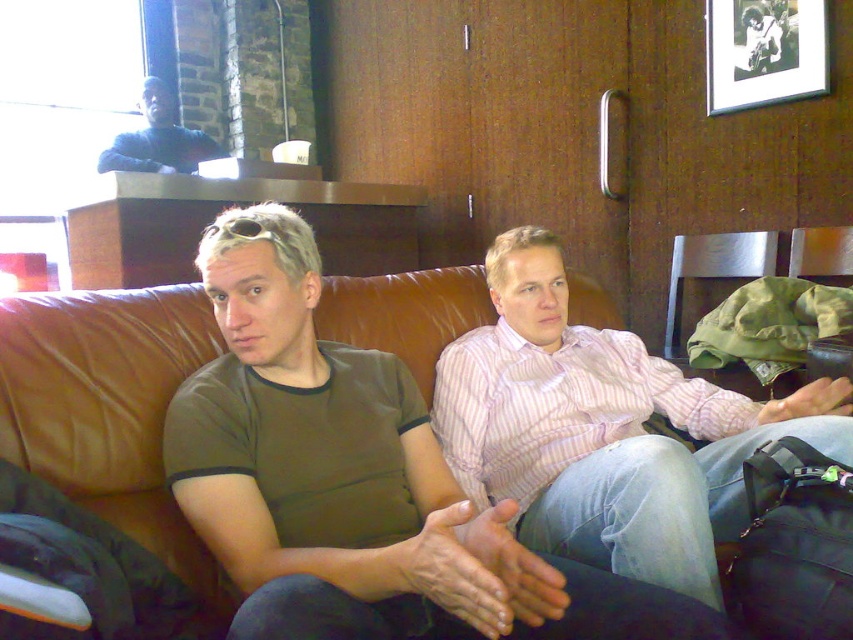
You are designing a room layout and need to place a floor lamp next to the brown leather couch at center. Considering the height of the black matte picture frame at upper right, will the floor lamp be taller than the picture frame?

The brown leather couch at center has a greater height compared to the black matte picture frame at upper right. Since the floor lamp will be placed next to the couch, it will likely be taller than the picture frame as the couch itself is already taller.

You are a tailor measuring the distance between the pink striped shirt at center and the brown leather couch at center for a new piece of furniture. Can you fit a 12.5 inch wide decorative tray between them?

Answer: The distance between the pink striped shirt at center and the brown leather couch at center is 12.97 inches. Since the tray is 12.5 inches wide, it can fit between them as there is enough space.

You are a tailor measuring clothing for alterations. You have a sewing machine that can handle fabrics up to 40 cm in width. You need to adjust both the pink striped shirt at center and the dark blue sweater at upper left. Based on their widths, which garment will require more careful handling to ensure it fits through the sewing machine?

The pink striped shirt at center has a greater width than the dark blue sweater at upper left. Since the sewing machine can handle up to 40 cm, the wider pink striped shirt at center would need more careful handling to ensure it fits through the machine properly.